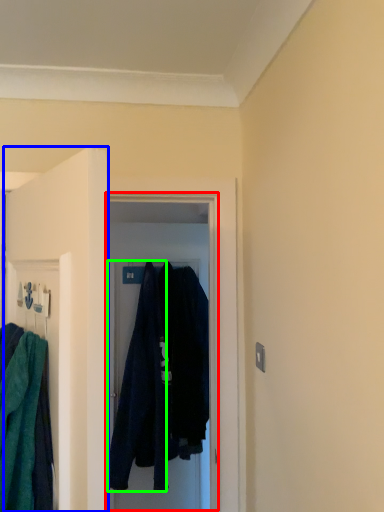
Question: Considering the real-world distances, which object is closest to glass door (highlighted by a red box)? door (highlighted by a blue box) or robe (highlighted by a green box).

Choices:
 (A) door
 (B) robe

Answer: (B)